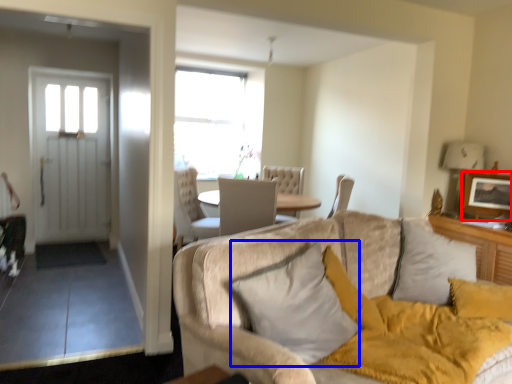
Question: Which object is closer to the camera taking this photo, picture frame (highlighted by a red box) or pillow (highlighted by a blue box)?

Choices:
 (A) picture frame
 (B) pillow

Answer: (B)